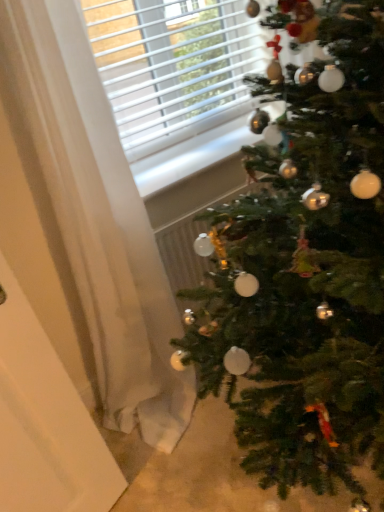
Find the location of `free space in front of white sheer curtain at left`. free space in front of white sheer curtain at left is located at coordinates (187, 473).